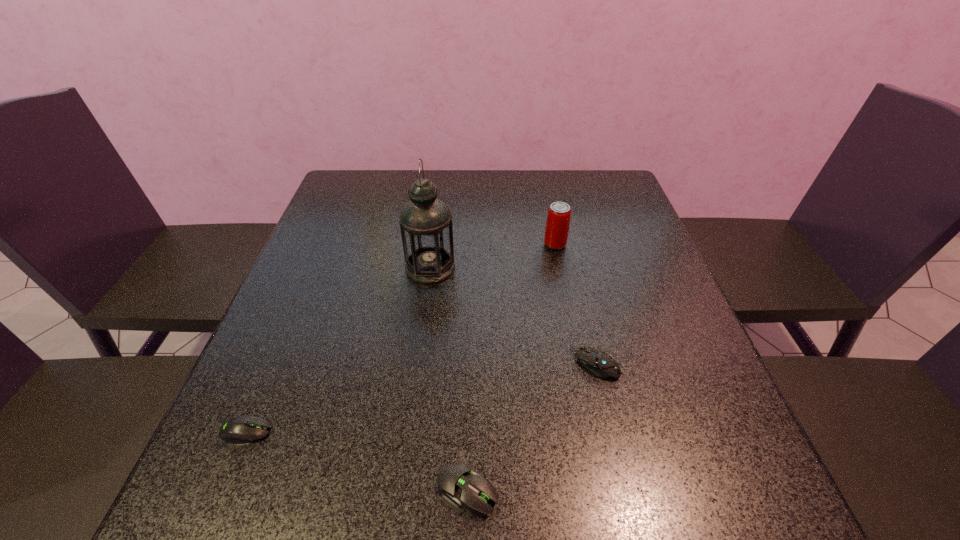
In order to click on the second farthest object in this screenshot , I will do `click(425, 222)`.

At what (x,y) coordinates should I click in order to perform the action: click on oil lamp. Please return your answer as a coordinate pair (x, y). Image resolution: width=960 pixels, height=540 pixels. Looking at the image, I should click on (425, 222).

Where is `the fourth shortest object`? Image resolution: width=960 pixels, height=540 pixels. the fourth shortest object is located at coordinates 559,213.

The height and width of the screenshot is (540, 960). Find the location of `beer can`. beer can is located at coordinates (559, 213).

Image resolution: width=960 pixels, height=540 pixels. Identify the location of the third nearest object. (598, 362).

Where is `the farthest computer mouse`? the farthest computer mouse is located at coordinates (598, 362).

Where is `the leftmost object`? The image size is (960, 540). the leftmost object is located at coordinates (243, 429).

At what (x,y) coordinates should I click in order to perform the action: click on the leftmost computer mouse. Please return your answer as a coordinate pair (x, y). The width and height of the screenshot is (960, 540). Looking at the image, I should click on (243, 429).

Locate an element on the screen. This screenshot has height=540, width=960. the second computer mouse from left to right is located at coordinates (459, 485).

You are a GUI agent. You are given a task and a screenshot of the screen. Output one action in this format:
    pyautogui.click(x=<x>, y=<y>)
    Task: Click on the nearest object
    The width and height of the screenshot is (960, 540).
    Given the screenshot: What is the action you would take?
    pyautogui.click(x=459, y=485)